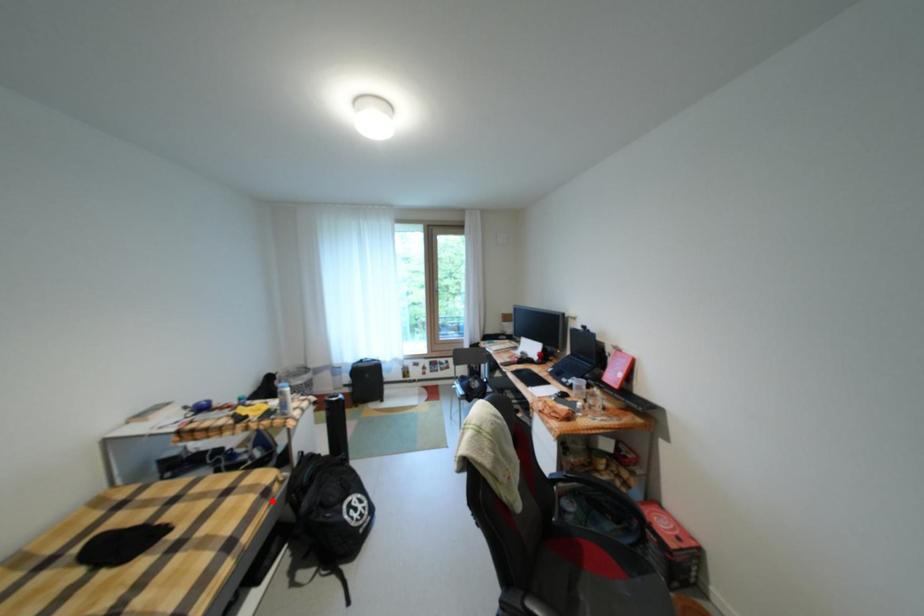
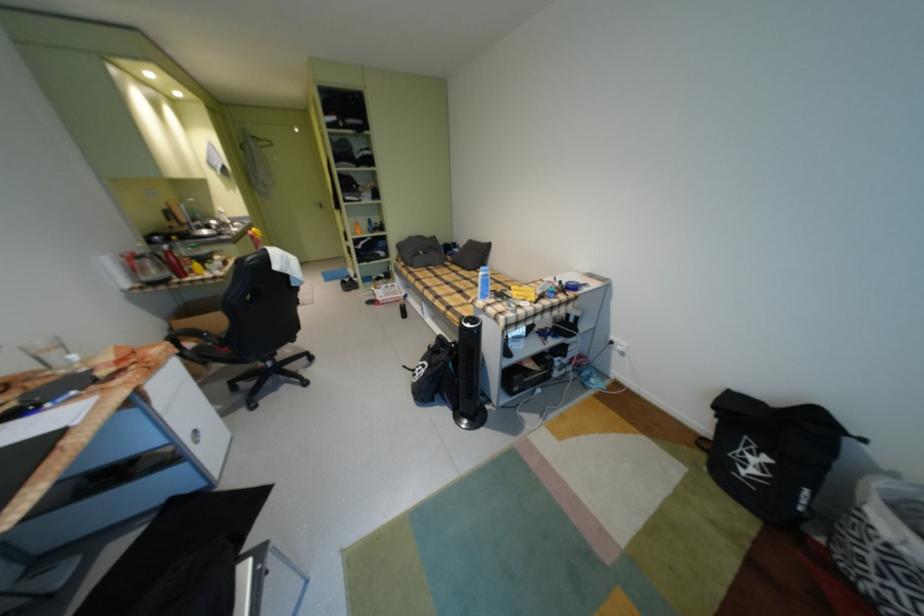
Question: A red point is marked in image1. In image2, is the corresponding 3D point closer to the camera or farther? Reply with the corresponding letter.

Choices:
 (A) The corresponding 3D point is closer.
 (B) The corresponding 3D point is farther.

Answer: (B)